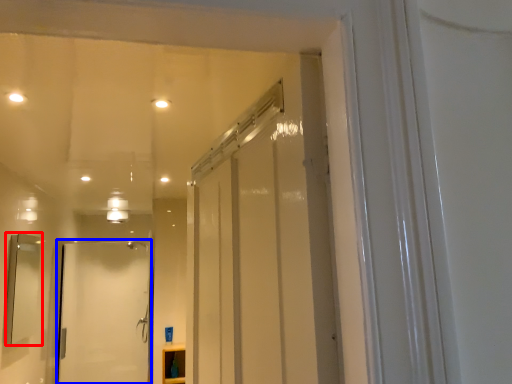
Question: Among these objects, which one is farthest to the camera, mirror (highlighted by a red box) or door (highlighted by a blue box)?

Choices:
 (A) mirror
 (B) door

Answer: (B)